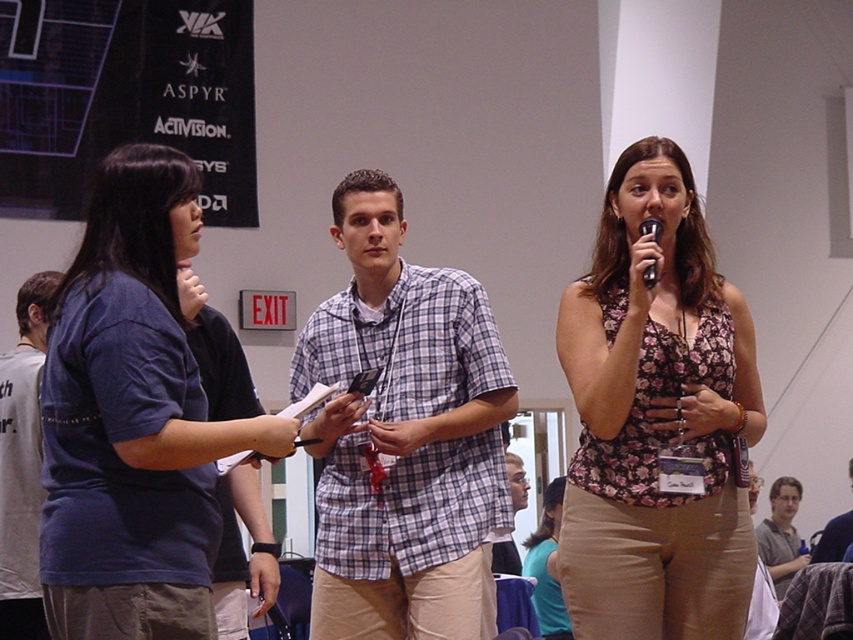
Where is the floral fabric top at center located in the image?

The floral fabric top at center is located at point coordinates of (656, 419).

In the scene shown: You are attending a presentation in the conference room and notice two presenters. Which presenter, the matte blue shirt at left or the checkered fabric shirt at center, is standing to the left of the other?

The matte blue shirt at left is positioned on the left side of checkered fabric shirt at center.

You are attending a presentation in the conference room and need to pass between the floral fabric top at center and the gray fabric shirt at lower right to reach the exit. Is there enough space for you to walk through comfortably?

The floral fabric top at center is closer to the viewer than the gray fabric shirt at lower right, so there is sufficient space between them for you to walk through comfortably.